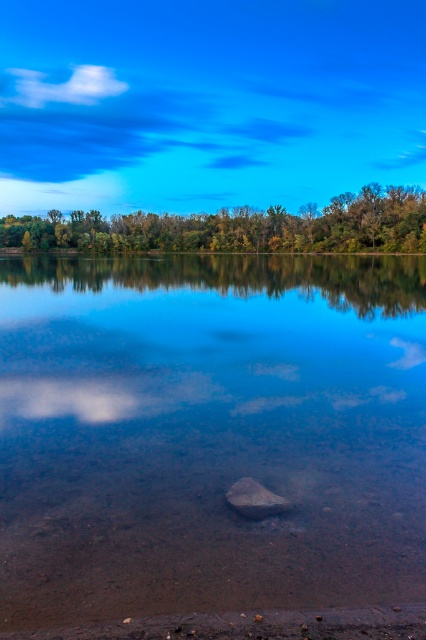
You are a photographer planning to capture the reflection of the white fluffy cloud at upper left and the smooth brown rock at center in the lake. Given that the distance between them is 1118.99 feet, can you estimate whether both will fit in your camera frame if your camera has a maximum horizontal field of view of 1100 feet?

The distance between the white fluffy cloud at upper left and the smooth brown rock at center is 1118.99 feet, which exceeds the camera frame of 1100 feet. Therefore, both objects cannot fit within the camera frame simultaneously.

You are an artist trying to paint the lakeside scene. You notice the green leafy trees at upper center and the white fluffy cloud at upper left. Which object appears taller in the painting?

The green leafy trees at upper center appear taller than the white fluffy cloud at upper left in the painting.